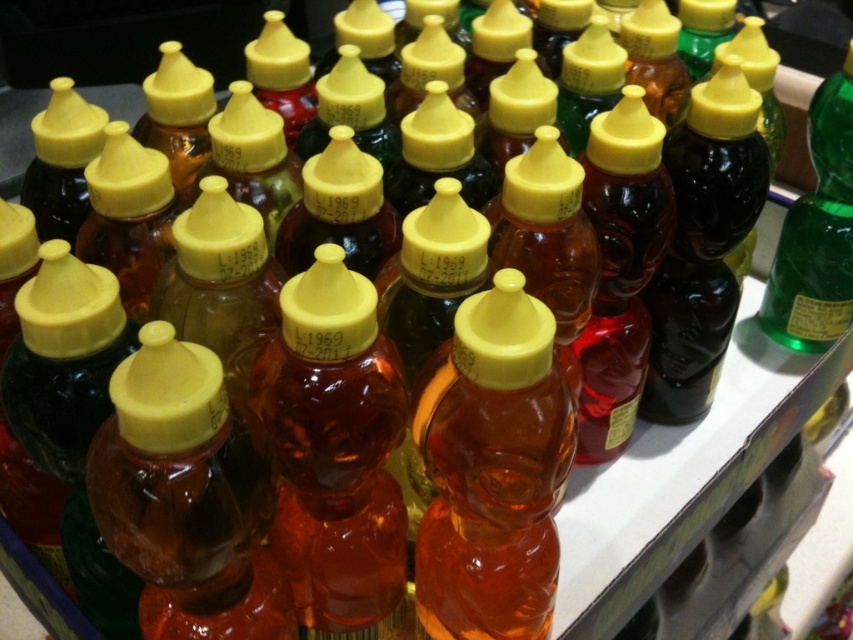
Is translucent amber liquid at center taller than green glass bottle at right?

No, translucent amber liquid at center is not taller than green glass bottle at right.

Which of these two, translucent amber liquid at center or green glass bottle at right, stands shorter?

With less height is translucent amber liquid at center.

The height and width of the screenshot is (640, 853). I want to click on translucent amber liquid at center, so [492, 470].